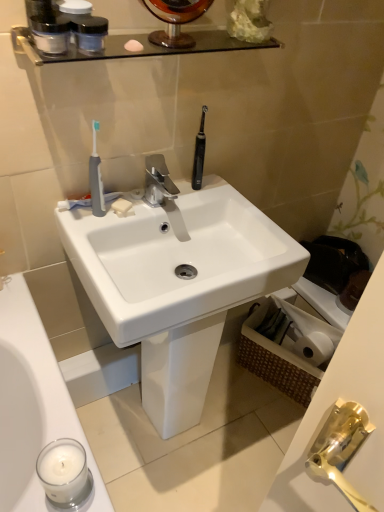
Question: Looking at the image, does gray rubber toothbrush at left seem bigger or smaller compared to translucent plastic containers at upper left, which appears as the 2th mouthwash when viewed from the right?

Choices:
 (A) small
 (B) big

Answer: (B)

Question: Choose the correct answer: Is gray rubber toothbrush at left inside translucent plastic containers at upper left, which appears as the 2th mouthwash when viewed from the right, or outside it?

Choices:
 (A) inside
 (B) outside

Answer: (B)

Question: Estimate the real-world distances between objects in this image. Which object is closer to the translucent plastic containers at upper left, which appears as the 2th mouthwash when viewed from the right?

Choices:
 (A) transparent glass shelf at upper center
 (B) white matte soap at center
 (C) white glossy sink at center
 (D) transparent plastic mouthwash at upper center, marked as the first mouthwash in a right-to-left arrangement
 (E) gray rubber toothbrush at left

Answer: (D)

Question: Which object is the closest to the matte black jars at upper left?

Choices:
 (A) white matte toilet paper at lower right
 (B) translucent plastic containers at upper left, which appears as the 2th mouthwash when viewed from the right
 (C) white matte soap at center
 (D) transparent plastic mouthwash at upper center, the 2th mouthwash in the left-to-right sequence
 (E) white glossy sink at center

Answer: (D)